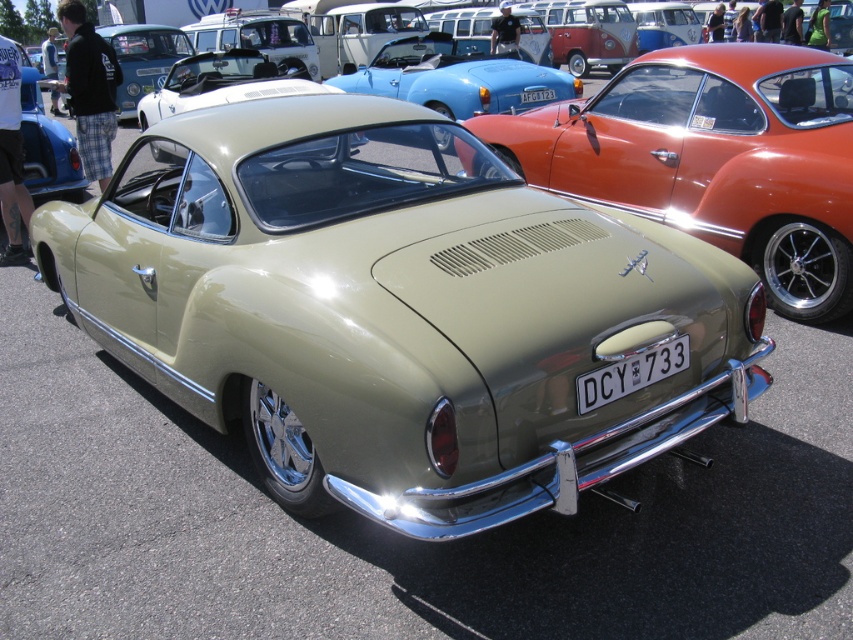
Question: Which of the following is the closest to the observer?

Choices:
 (A) white metallic license plate at center
 (B) matte green car at center

Answer: (A)

Question: Which of the following is the farthest from the observer?

Choices:
 (A) matte green car at center
 (B) white metallic license plate at center
 (C) white plastic license plate at center

Answer: (C)

Question: Is white metallic license plate at center above white plastic license plate at center?

Choices:
 (A) no
 (B) yes

Answer: (A)

Question: Which of the following is the farthest from the observer?

Choices:
 (A) (688, 348)
 (B) (550, 97)

Answer: (B)

Question: Does matte green car at center appear under white metallic license plate at center?

Choices:
 (A) yes
 (B) no

Answer: (B)

Question: Can you confirm if matte green car at center is positioned below white metallic license plate at center?

Choices:
 (A) no
 (B) yes

Answer: (A)